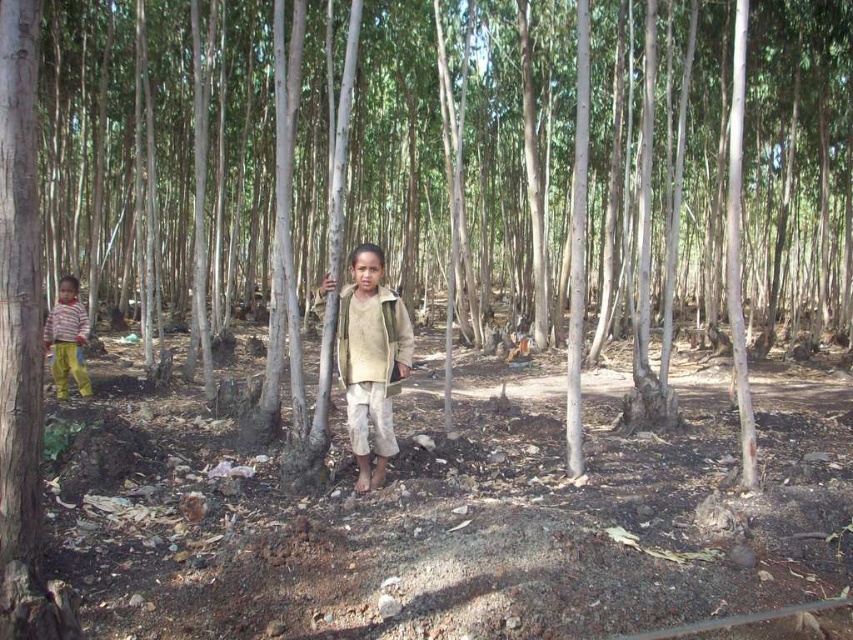
Locate an element on the screen. light beige fabric jacket at center is located at coordinates (370, 360).

Which is more to the right, light beige fabric jacket at center or striped cotton pants at left?

Positioned to the right is light beige fabric jacket at center.

This screenshot has width=853, height=640. What do you see at coordinates (370, 360) in the screenshot?
I see `light beige fabric jacket at center` at bounding box center [370, 360].

Where is `light beige fabric jacket at center`? light beige fabric jacket at center is located at coordinates (370, 360).